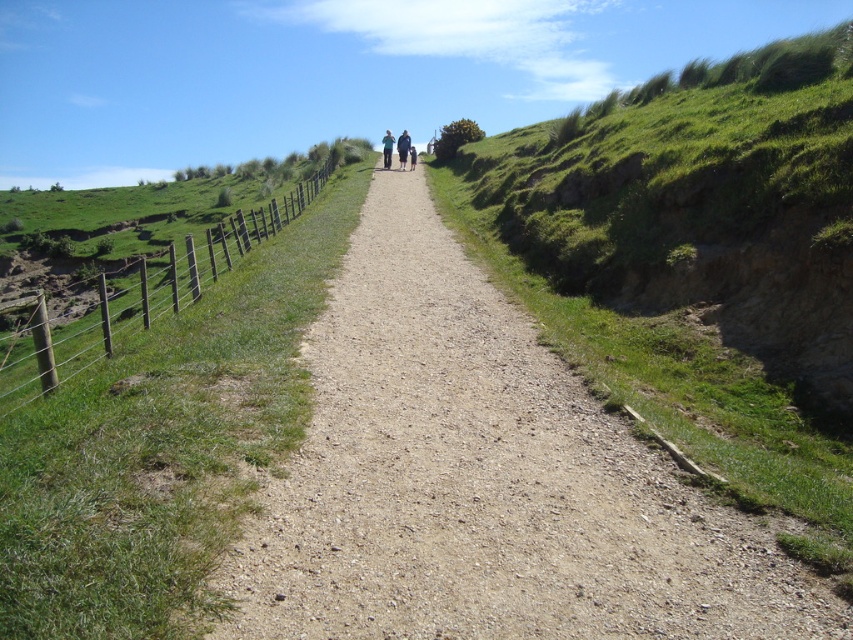
Question: Is dirt/gravel path at center thinner than green wooden fence at left?

Choices:
 (A) yes
 (B) no

Answer: (A)

Question: Is green wooden fence at left to the left of light blue denim jacket at center from the viewer's perspective?

Choices:
 (A) yes
 (B) no

Answer: (A)

Question: Can you confirm if green wooden fence at left is positioned above dark blue jeans at center?

Choices:
 (A) no
 (B) yes

Answer: (A)

Question: Which object is the closest to the dark blue jacket at center?

Choices:
 (A) dark blue jeans at center
 (B) green wooden fence at left

Answer: (A)

Question: Which object is closer to the camera taking this photo?

Choices:
 (A) green wooden fence at left
 (B) light blue denim jacket at center
 (C) dark blue jacket at center

Answer: (A)

Question: Among these objects, which one is nearest to the camera?

Choices:
 (A) dark blue jacket at center
 (B) light blue denim jacket at center
 (C) dirt/gravel path at center

Answer: (C)